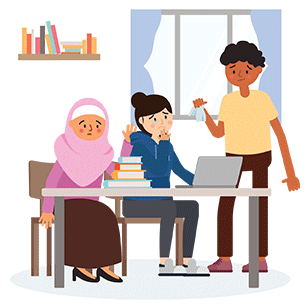
Locate an element on the screen. This screenshot has width=306, height=306. gray table legs is located at coordinates (58, 236), (255, 236).